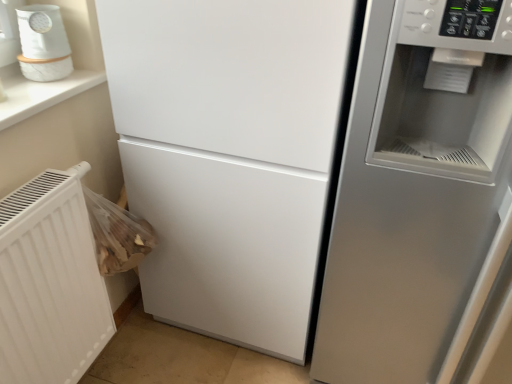
Question: From the image's perspective, would you say satin silver fridge at right is positioned over white glossy humidifier at upper left?

Choices:
 (A) yes
 (B) no

Answer: (B)

Question: Considering the relative positions of satin silver fridge at right and white glossy humidifier at upper left in the image provided, is satin silver fridge at right to the right of white glossy humidifier at upper left from the viewer's perspective?

Choices:
 (A) yes
 (B) no

Answer: (A)

Question: From the image's perspective, would you say satin silver fridge at right is shown under white glossy humidifier at upper left?

Choices:
 (A) no
 (B) yes

Answer: (B)

Question: From a real-world perspective, is satin silver fridge at right beneath white glossy humidifier at upper left?

Choices:
 (A) yes
 (B) no

Answer: (A)

Question: Does satin silver fridge at right have a smaller size compared to white glossy humidifier at upper left?

Choices:
 (A) no
 (B) yes

Answer: (A)

Question: Is satin silver fridge at right to the left of white glossy humidifier at upper left from the viewer's perspective?

Choices:
 (A) yes
 (B) no

Answer: (B)

Question: Considering the relative sizes of white textured radiator at lower left and satin silver fridge at right in the image provided, is white textured radiator at lower left taller than satin silver fridge at right?

Choices:
 (A) yes
 (B) no

Answer: (B)

Question: From the image's perspective, is white textured radiator at lower left on top of satin silver fridge at right?

Choices:
 (A) no
 (B) yes

Answer: (A)

Question: Is white textured radiator at lower left further to the viewer compared to satin silver fridge at right?

Choices:
 (A) yes
 (B) no

Answer: (A)

Question: Considering the relative sizes of white textured radiator at lower left and satin silver fridge at right in the image provided, is white textured radiator at lower left bigger than satin silver fridge at right?

Choices:
 (A) yes
 (B) no

Answer: (B)

Question: Is white textured radiator at lower left oriented towards satin silver fridge at right?

Choices:
 (A) no
 (B) yes

Answer: (B)

Question: Is satin silver fridge at right inside white textured radiator at lower left?

Choices:
 (A) yes
 (B) no

Answer: (B)

Question: Does satin silver fridge at right appear on the left side of white textured radiator at lower left?

Choices:
 (A) no
 (B) yes

Answer: (A)